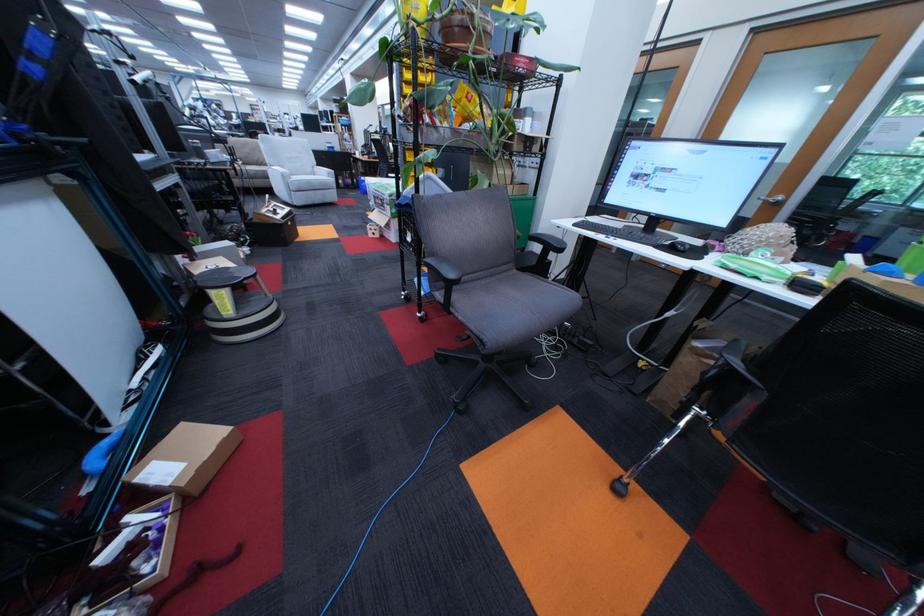
Find the location of a particular element. grey chair sitting surface is located at coordinates (514, 314).